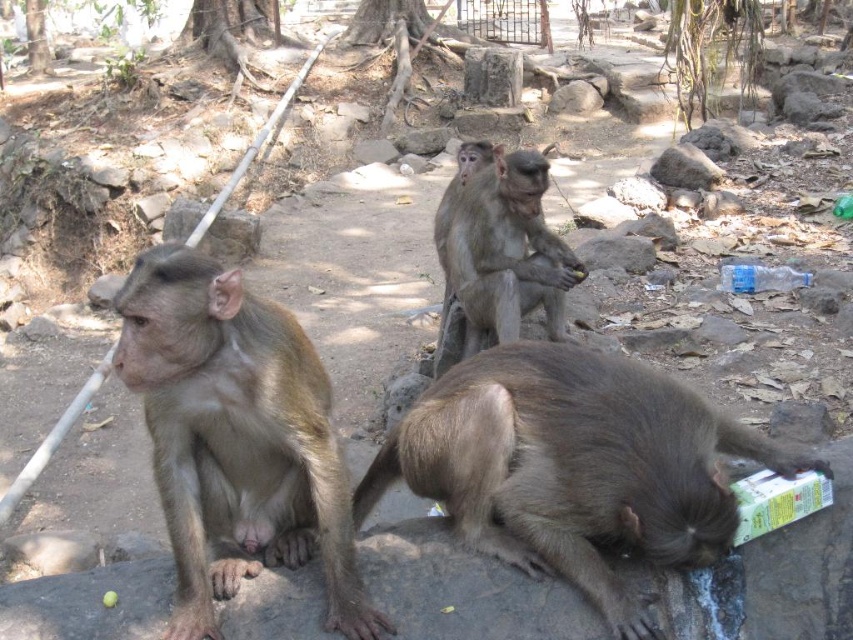
Question: Is brown furry monkey at lower right below fuzzy brown monkey at left?

Choices:
 (A) yes
 (B) no

Answer: (A)

Question: Can you confirm if brown furry monkey at lower right is positioned to the right of gray furry monkey at center?

Choices:
 (A) no
 (B) yes

Answer: (B)

Question: Estimate the real-world distances between objects in this image. Which object is closer to the fuzzy brown monkey at left?

Choices:
 (A) gray furry monkey at center
 (B) brown furry monkey at lower right

Answer: (B)

Question: Which object is closer to the camera taking this photo?

Choices:
 (A) fuzzy brown monkey at left
 (B) gray furry monkey at center
 (C) brown furry monkey at lower right

Answer: (A)

Question: Is the position of brown furry monkey at lower right more distant than that of gray furry monkey at center?

Choices:
 (A) no
 (B) yes

Answer: (A)

Question: Considering the real-world distances, which object is farthest from the brown furry monkey at lower right?

Choices:
 (A) fuzzy brown monkey at left
 (B) gray furry monkey at center

Answer: (B)